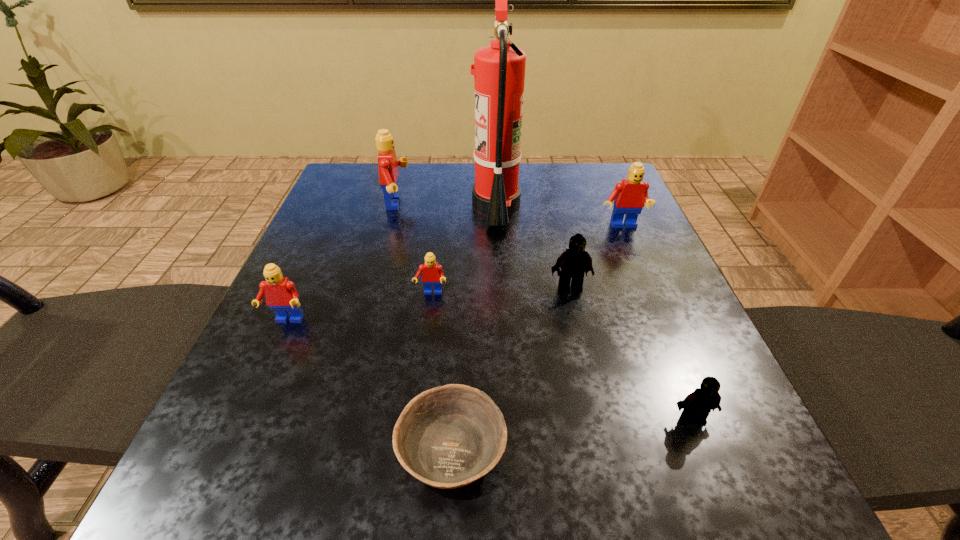
Locate an element on the screen. red Lego identified as the third closest to the nearer black Lego is located at coordinates (281, 296).

Select which red Lego appears as the third closest to the farthest red Lego. Please provide its 2D coordinates. Your answer should be formatted as a tuple, i.e. [(x, y)], where the tuple contains the x and y coordinates of a point satisfying the conditions above.

[(629, 196)]